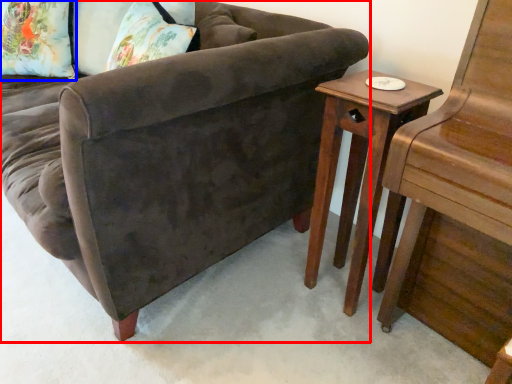
Question: Among these objects, which one is farthest to the camera, studio couch (highlighted by a red box) or pillow (highlighted by a blue box)?

Choices:
 (A) studio couch
 (B) pillow

Answer: (B)